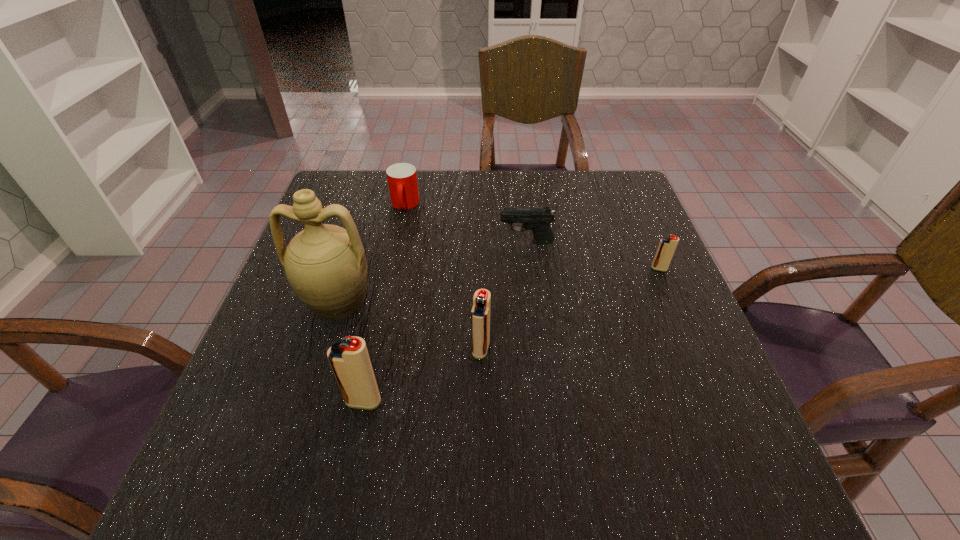
The height and width of the screenshot is (540, 960). I want to click on the second closest object to the leftmost igniter, so click(x=480, y=314).

Select which object is the fourth closest to the leftmost igniter. Please provide its 2D coordinates. Your answer should be formatted as a tuple, i.e. [(x, y)], where the tuple contains the x and y coordinates of a point satisfying the conditions above.

[(402, 180)]

Where is `the third closest igniter to the pitcher`? the third closest igniter to the pitcher is located at coordinates (667, 246).

Locate an element on the screen. The height and width of the screenshot is (540, 960). igniter that is the closest to the farthest igniter is located at coordinates (480, 314).

I want to click on free spot that satisfies the following two spatial constraints: 1. on the back side of the nearest igniter; 2. on the right side of the third object from right to left, so click(374, 349).

Locate an element on the screen. vacant point that satisfies the following two spatial constraints: 1. at the barrel of the fifth object from left to right; 2. on the front side of the nearest object is located at coordinates (545, 401).

You are a GUI agent. You are given a task and a screenshot of the screen. Output one action in this format:
    pyautogui.click(x=<x>, y=<y>)
    Task: Click on the free space that satisfies the following two spatial constraints: 1. at the barrel of the second object from right to left; 2. on the front side of the nearest object
    The height and width of the screenshot is (540, 960).
    Given the screenshot: What is the action you would take?
    pyautogui.click(x=545, y=401)